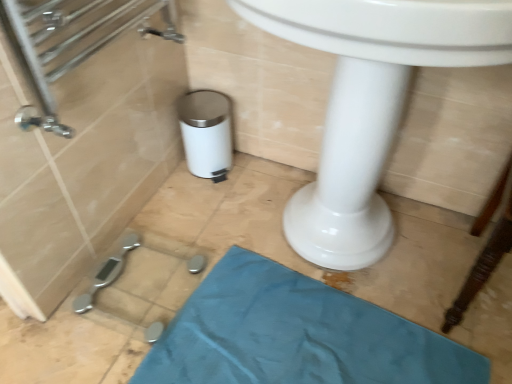
Question: Which is correct: white glossy sink at center is inside teal fabric bath mat at lower center, or outside of it?

Choices:
 (A) inside
 (B) outside

Answer: (B)

Question: Is white glossy sink at center taller or shorter than teal fabric bath mat at lower center?

Choices:
 (A) short
 (B) tall

Answer: (B)

Question: Considering the positions of white glossy sink at center and teal fabric bath mat at lower center in the image, is white glossy sink at center bigger or smaller than teal fabric bath mat at lower center?

Choices:
 (A) big
 (B) small

Answer: (A)

Question: Is teal fabric bath mat at lower center situated inside white glossy sink at center or outside?

Choices:
 (A) inside
 (B) outside

Answer: (B)

Question: Considering the positions of teal fabric bath mat at lower center and white glossy sink at center in the image, is teal fabric bath mat at lower center taller or shorter than white glossy sink at center?

Choices:
 (A) short
 (B) tall

Answer: (A)

Question: Does point (417, 372) appear closer or farther from the camera than point (374, 223)?

Choices:
 (A) farther
 (B) closer

Answer: (B)

Question: Considering the relative positions of teal fabric bath mat at lower center and white glossy sink at center in the image provided, is teal fabric bath mat at lower center to the left or to the right of white glossy sink at center?

Choices:
 (A) right
 (B) left

Answer: (B)